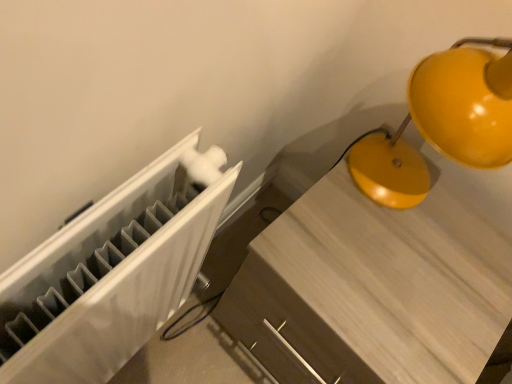
Question: Is matte yellow lamp at upper right bigger or smaller than matte wood table at center?

Choices:
 (A) small
 (B) big

Answer: (A)

Question: From their relative heights in the image, would you say matte yellow lamp at upper right is taller or shorter than matte wood table at center?

Choices:
 (A) tall
 (B) short

Answer: (B)

Question: From a real-world perspective, is matte yellow lamp at upper right physically located above or below matte wood table at center?

Choices:
 (A) above
 (B) below

Answer: (A)

Question: From their relative heights in the image, would you say matte wood table at center is taller or shorter than matte yellow lamp at upper right?

Choices:
 (A) tall
 (B) short

Answer: (A)

Question: Looking at their shapes, would you say matte wood table at center is wider or thinner than matte yellow lamp at upper right?

Choices:
 (A) wide
 (B) thin

Answer: (A)

Question: Based on their sizes in the image, would you say matte wood table at center is bigger or smaller than matte yellow lamp at upper right?

Choices:
 (A) small
 (B) big

Answer: (B)

Question: From the image's perspective, is matte wood table at center above or below matte yellow lamp at upper right?

Choices:
 (A) above
 (B) below

Answer: (B)